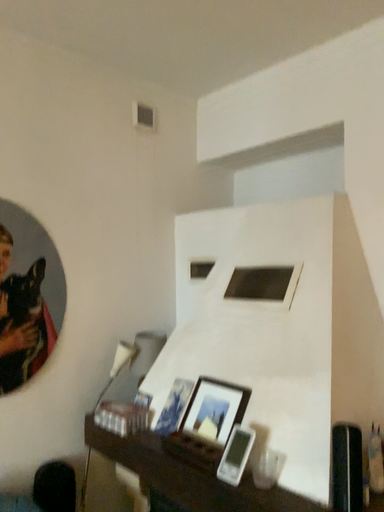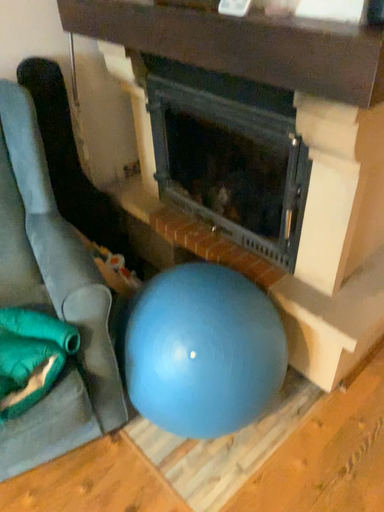
Question: How did the camera likely rotate when shooting the video?

Choices:
 (A) rotated downward
 (B) rotated upward

Answer: (A)